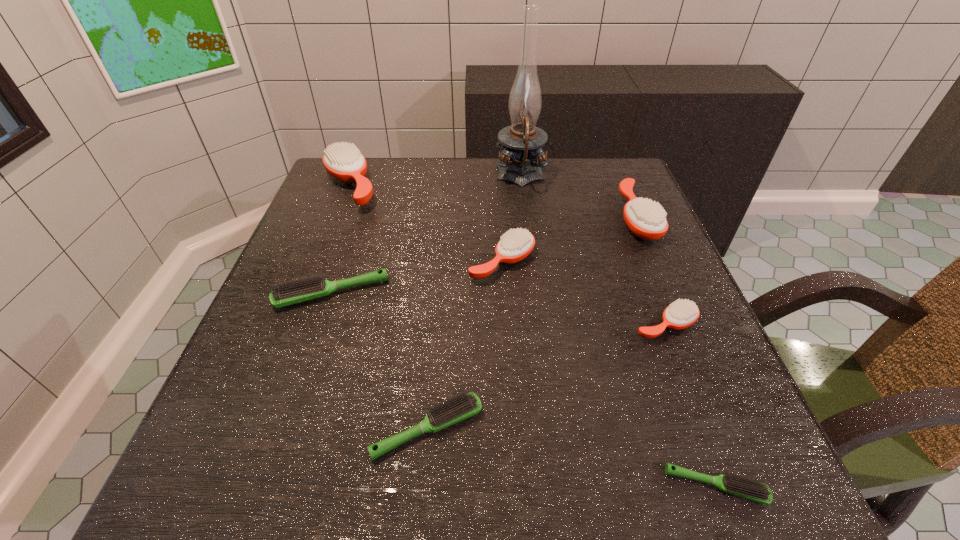
Find the location of a particular element. This screenshot has width=960, height=540. vacant point located between the smallest orange hairbrush and the seventh farthest object is located at coordinates (546, 377).

Where is `free space between the leftmost light hairbrush and the third orange hairbrush from right to left`? free space between the leftmost light hairbrush and the third orange hairbrush from right to left is located at coordinates (417, 277).

Identify the location of object that is the third closest one to the second biggest orange hairbrush. (516, 244).

Select which object is the third closest to the nearest light hairbrush. Please provide its 2D coordinates. Your answer should be formatted as a tuple, i.e. [(x, y)], where the tuple contains the x and y coordinates of a point satisfying the conditions above.

[(516, 244)]

The width and height of the screenshot is (960, 540). I want to click on hairbrush identified as the fifth closest to the second tallest hairbrush, so click(287, 293).

Locate an element on the screen. This screenshot has width=960, height=540. hairbrush identified as the fifth closest to the rightmost light hairbrush is located at coordinates (287, 293).

This screenshot has height=540, width=960. Find the location of `orange hairbrush object that ranks as the third closest to the smallest orange hairbrush`. orange hairbrush object that ranks as the third closest to the smallest orange hairbrush is located at coordinates (344, 162).

Where is `the closest orange hairbrush relative to the second light hairbrush from left to right`? the closest orange hairbrush relative to the second light hairbrush from left to right is located at coordinates (516, 244).

Locate which light hairbrush ranks in proximity to the nearest light hairbrush. Please provide its 2D coordinates. Your answer should be formatted as a tuple, i.e. [(x, y)], where the tuple contains the x and y coordinates of a point satisfying the conditions above.

[(464, 406)]

Locate which light hairbrush ranks third in proximity to the fifth shortest object. Please provide its 2D coordinates. Your answer should be formatted as a tuple, i.e. [(x, y)], where the tuple contains the x and y coordinates of a point satisfying the conditions above.

[(749, 488)]